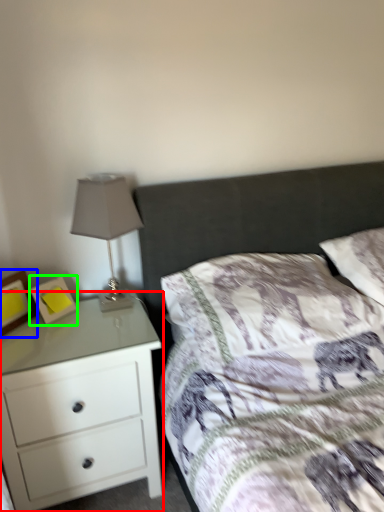
Question: Estimate the real-world distances between objects in this image. Which object is closer to chest of drawers (highlighted by a red box), picture frame (highlighted by a blue box) or picture frame (highlighted by a green box)?

Choices:
 (A) picture frame
 (B) picture frame

Answer: (B)